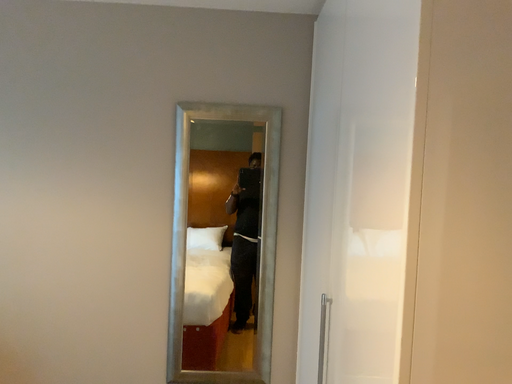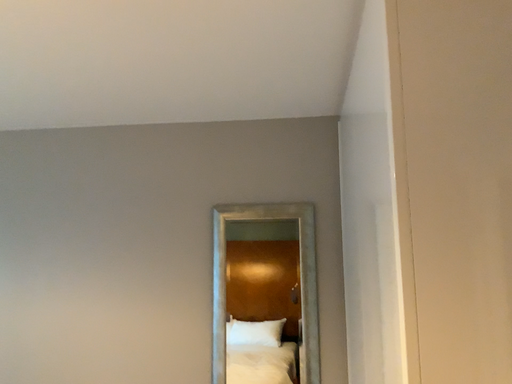
Question: Which way did the camera rotate in the video?

Choices:
 (A) rotated downward
 (B) rotated upward

Answer: (B)